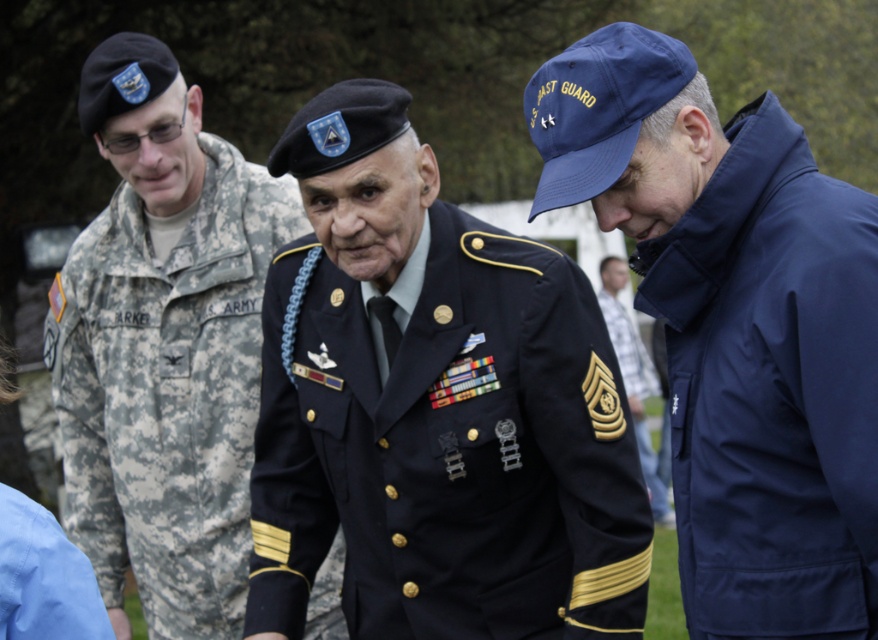
What are the coordinates of the navy blue jacket at lower right?

The navy blue jacket at lower right is located at coordinates point (736, 326).